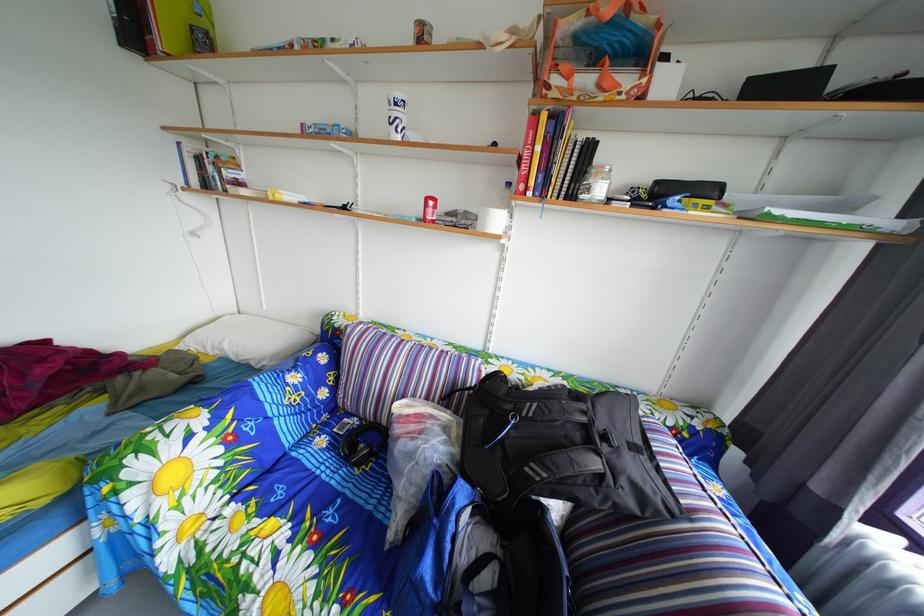
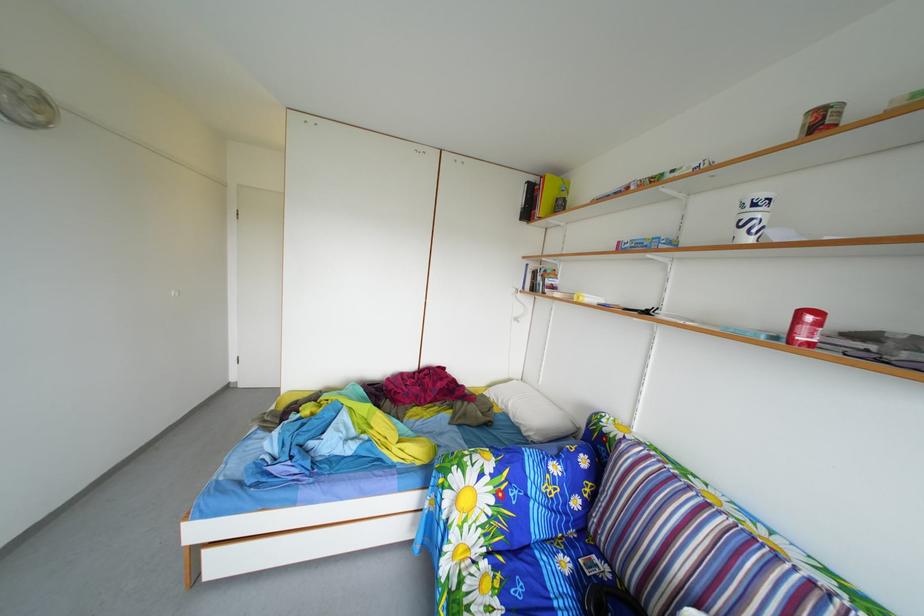
The point at (333, 448) is marked in the first image. Where is the corresponding point in the second image?

(576, 570)